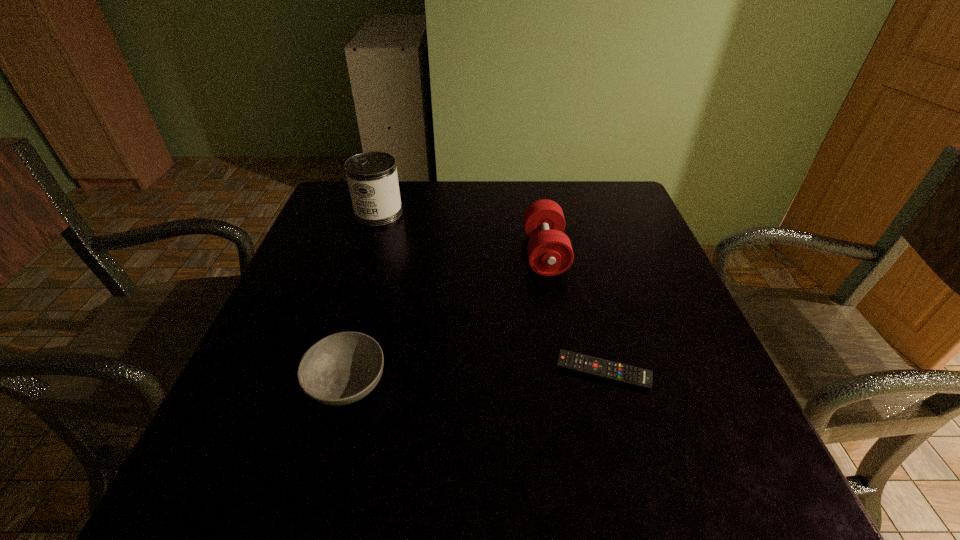
This screenshot has width=960, height=540. What are the coordinates of `object located at the far edge` in the screenshot? It's located at (372, 178).

The height and width of the screenshot is (540, 960). In order to click on can that is positioned at the left edge in this screenshot , I will do `click(372, 178)`.

Find the location of a particular element. This screenshot has height=540, width=960. bowl present at the left edge is located at coordinates (342, 368).

You are a GUI agent. You are given a task and a screenshot of the screen. Output one action in this format:
    pyautogui.click(x=<x>, y=<y>)
    Task: Click on the object located at the right edge
    The height and width of the screenshot is (540, 960).
    Given the screenshot: What is the action you would take?
    pyautogui.click(x=596, y=367)

Locate an element on the screen. This screenshot has height=540, width=960. object positioned at the far left corner is located at coordinates (372, 178).

In the image, there is a desktop. Identify the location of vacant space at the far edge. The image size is (960, 540). (406, 194).

Locate an element on the screen. This screenshot has width=960, height=540. vacant area at the left edge is located at coordinates (293, 369).

Locate an element on the screen. The height and width of the screenshot is (540, 960). vacant space at the right edge of the desktop is located at coordinates (640, 363).

You are a GUI agent. You are given a task and a screenshot of the screen. Output one action in this format:
    pyautogui.click(x=<x>, y=<y>)
    Task: Click on the blank space at the far left corner of the desktop
    This screenshot has height=540, width=960.
    Given the screenshot: What is the action you would take?
    pyautogui.click(x=333, y=201)

The height and width of the screenshot is (540, 960). Find the location of `vacant space at the far right corner`. vacant space at the far right corner is located at coordinates (615, 223).